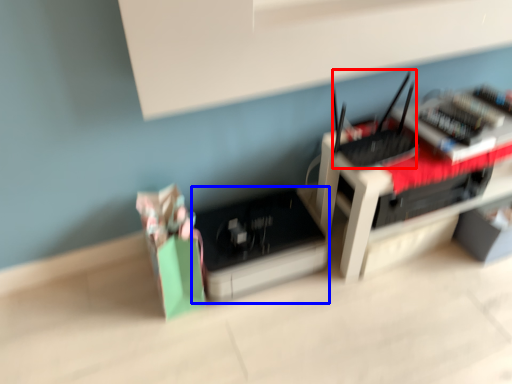
Question: Which object appears farthest to the camera in this image, register (highlighted by a red box) or register (highlighted by a blue box)?

Choices:
 (A) register
 (B) register

Answer: (B)